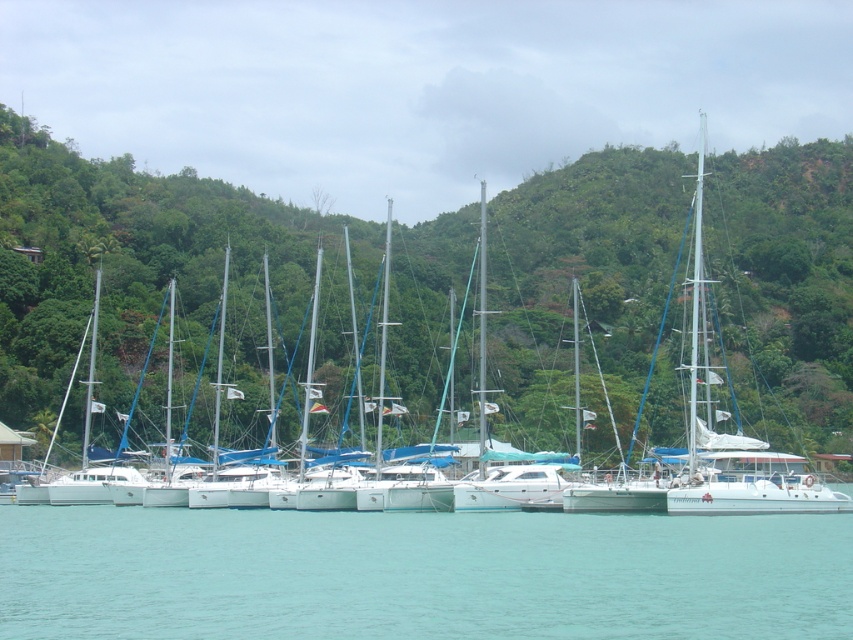
From the picture: You are an observer looking at the marina scene. You notice the green leafy tree at center and the clear blue water at lower center. Which object is closer to you?

The green leafy tree at center is closer to you because the clear blue water at lower center is positioned behind it.

You are a photographer planning to take a landscape photo of the green leafy tree at center and the clear blue water at lower center. Which object will appear larger in the photo?

The green leafy tree at center will appear larger in the photo because it is much taller than the clear blue water at lower center.